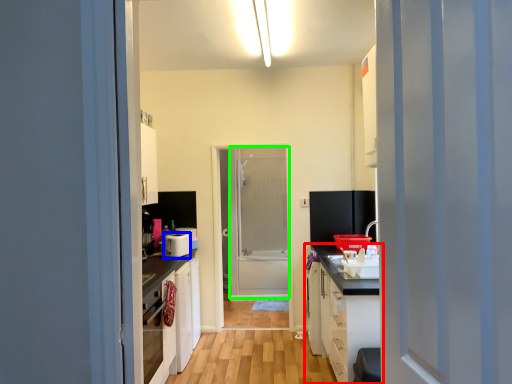
Question: Which object is the farthest from cabinetry (highlighted by a red box)? Choose among these: appliance (highlighted by a blue box) or screen door (highlighted by a green box).

Choices:
 (A) appliance
 (B) screen door

Answer: (B)